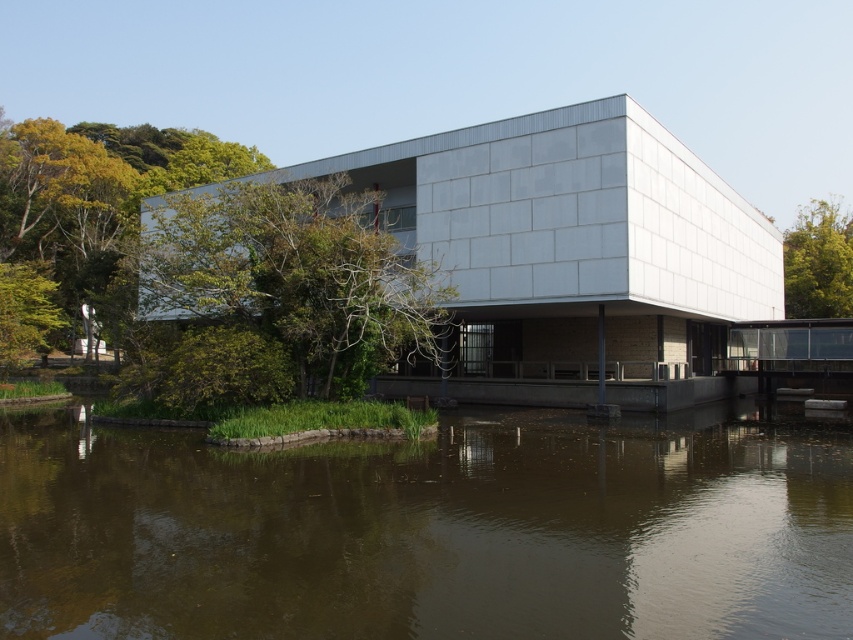
Who is positioned more to the left, green leafy tree at center or green leafy tree at upper right?

green leafy tree at center is more to the left.

Describe the element at coordinates (280, 292) in the screenshot. I see `green leafy tree at center` at that location.

Between point (218, 237) and point (795, 304), which one is positioned in front?

Point (218, 237)

Where is `green leafy tree at center`? Image resolution: width=853 pixels, height=640 pixels. green leafy tree at center is located at coordinates (280, 292).

Is point (430, 492) positioned after point (810, 202)?

That is False.

Can you confirm if brown murky water at lower center is bigger than green leafy tree at upper right?

No.

Where is `brown murky water at lower center`? brown murky water at lower center is located at coordinates (428, 531).

Is brown murky water at lower center bigger than green leafy tree at center?

Actually, brown murky water at lower center might be smaller than green leafy tree at center.

The image size is (853, 640). Identify the location of brown murky water at lower center. (428, 531).